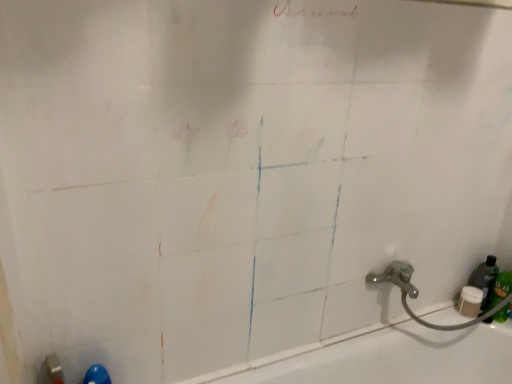
Question: Choose the correct answer: Is white glossy bathtub at lower right inside green matte bottle at lower right or outside it?

Choices:
 (A) outside
 (B) inside

Answer: (A)

Question: Visually, is white glossy bathtub at lower right positioned to the left or to the right of green matte bottle at lower right?

Choices:
 (A) left
 (B) right

Answer: (A)

Question: From a real-world perspective, is white glossy bathtub at lower right positioned above or below green matte bottle at lower right?

Choices:
 (A) above
 (B) below

Answer: (B)

Question: Is green matte bottle at lower right in front of or behind white glossy bathtub at lower right in the image?

Choices:
 (A) behind
 (B) front

Answer: (A)

Question: Is green matte bottle at lower right bigger or smaller than white glossy bathtub at lower right?

Choices:
 (A) small
 (B) big

Answer: (A)

Question: Does point (484, 284) appear closer or farther from the camera than point (289, 370)?

Choices:
 (A) closer
 (B) farther

Answer: (B)

Question: Choose the correct answer: Is green matte bottle at lower right inside white glossy bathtub at lower right or outside it?

Choices:
 (A) inside
 (B) outside

Answer: (B)